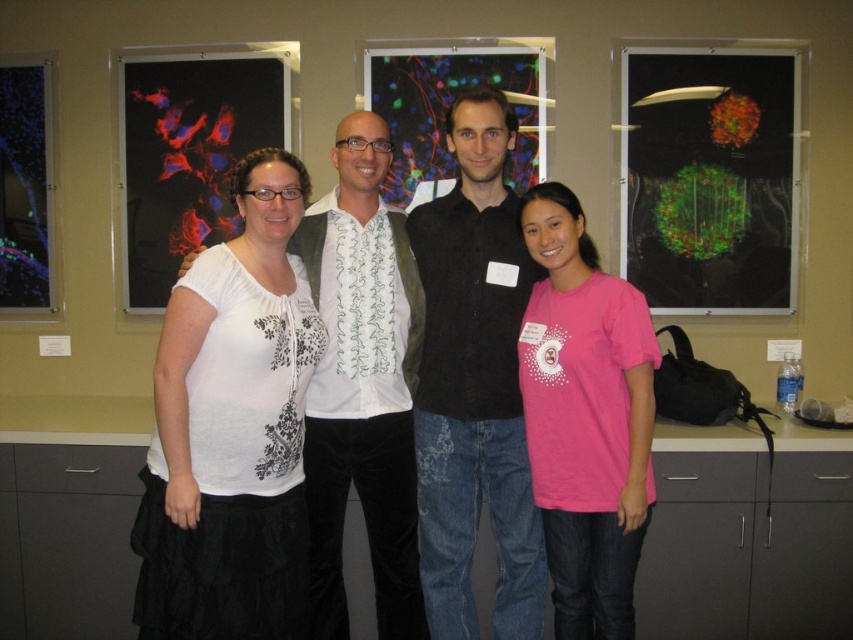
Who is more forward, (461, 522) or (647, 419)?

Positioned in front is point (647, 419).

The height and width of the screenshot is (640, 853). Identify the location of black matte shirt at center. (474, 384).

Which of these two, white lace blouse at center or pink fabric shirt at center, stands shorter?

white lace blouse at center

Does white lace blouse at center come in front of pink fabric shirt at center?

Yes, white lace blouse at center is closer to the viewer.

Does point (231, 348) lie behind point (550, 515)?

No, it is not.

At what (x,y) coordinates should I click in order to perform the action: click on white lace blouse at center. Please return your answer as a coordinate pair (x, y). Looking at the image, I should click on (231, 429).

In the scene shown: Is white printed shirt at center to the right of pink fabric shirt at center from the viewer's perspective?

No, white printed shirt at center is not to the right of pink fabric shirt at center.

Which is below, white printed shirt at center or pink fabric shirt at center?

pink fabric shirt at center is lower down.

Is point (366, 376) more distant than point (535, 307)?

That is True.

Where is `white printed shirt at center`? The width and height of the screenshot is (853, 640). white printed shirt at center is located at coordinates (363, 385).